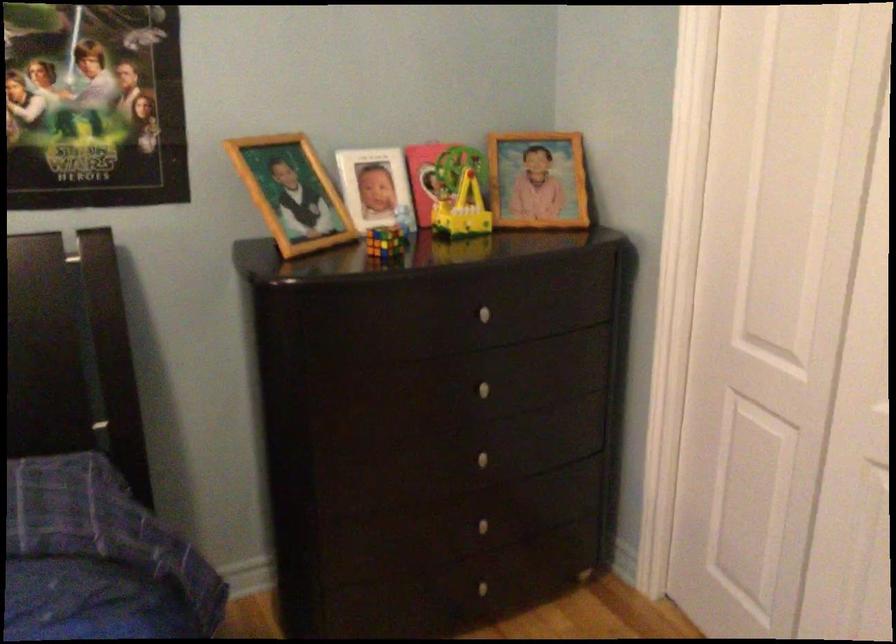
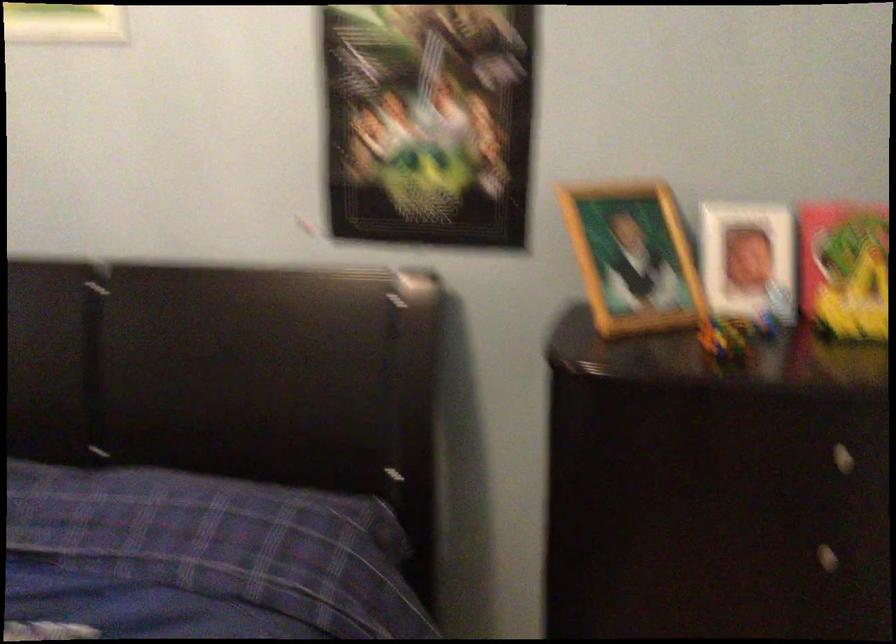
Question: How did the camera likely rotate?

Choices:
 (A) Left
 (B) Right
 (C) Up
 (D) Down

Answer: (A)